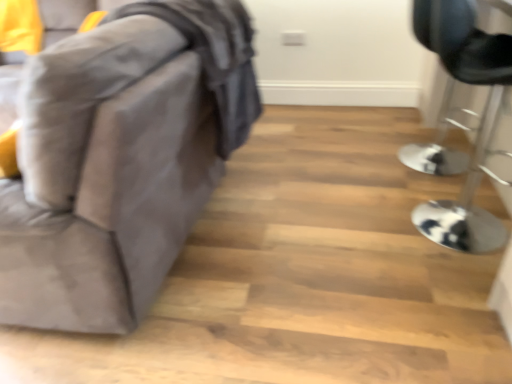
This screenshot has width=512, height=384. Find the location of `vacant space positioned to the left of metallic silver bar stool at right, which is counted as the second furniture, starting from the left`. vacant space positioned to the left of metallic silver bar stool at right, which is counted as the second furniture, starting from the left is located at coordinates (354, 245).